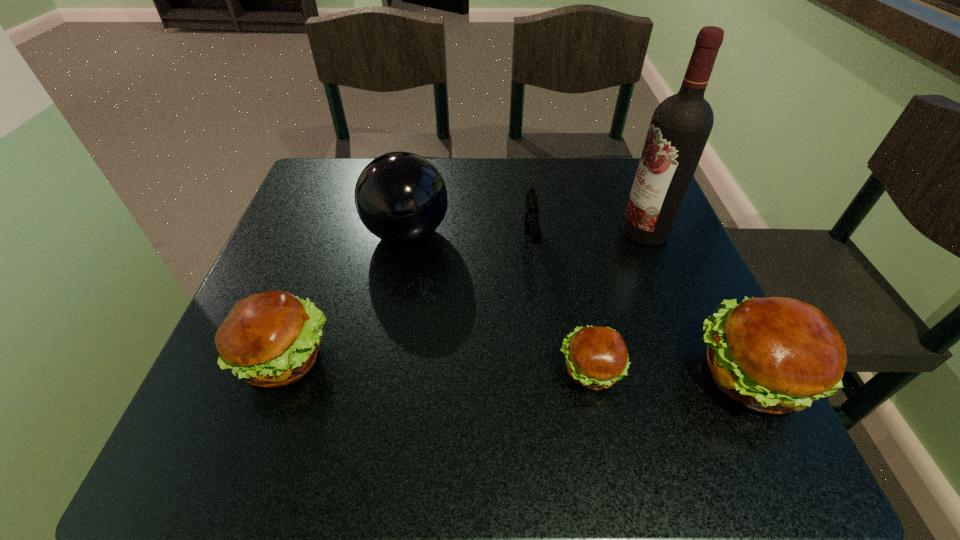
Where is `free region that satisfies the following two spatial constraints: 1. on the front-facing side of the third object from left to right; 2. on the left side of the shortest object`? free region that satisfies the following two spatial constraints: 1. on the front-facing side of the third object from left to right; 2. on the left side of the shortest object is located at coordinates (545, 370).